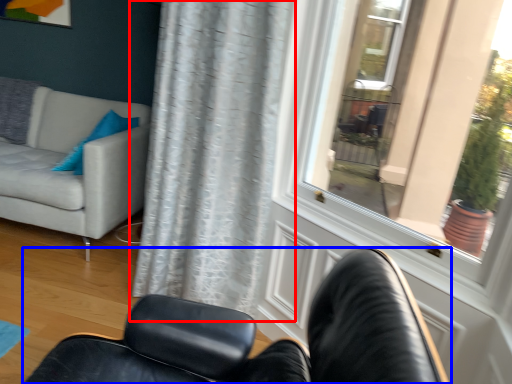
Question: Which of the following is the closest to the observer, curtain (highlighted by a red box) or chair (highlighted by a blue box)?

Choices:
 (A) curtain
 (B) chair

Answer: (B)